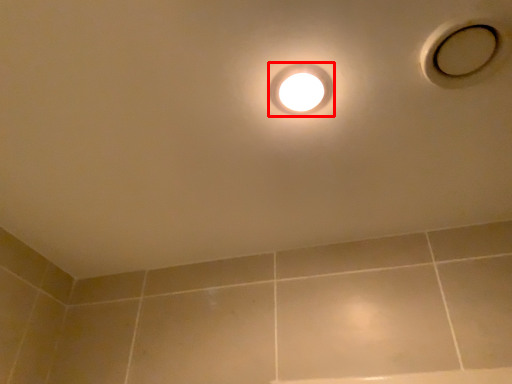
Question: In this image, where is droplight (annotated by the red box) located relative to hole?

Choices:
 (A) left
 (B) right

Answer: (A)